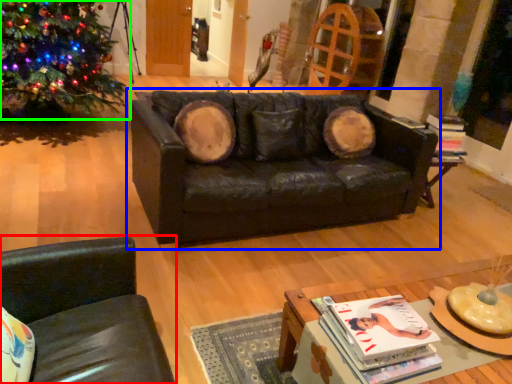
Question: Which object is positioned closest to chair (highlighted by a red box)? Select from studio couch (highlighted by a blue box) and christmas tree (highlighted by a green box).

Choices:
 (A) studio couch
 (B) christmas tree

Answer: (A)